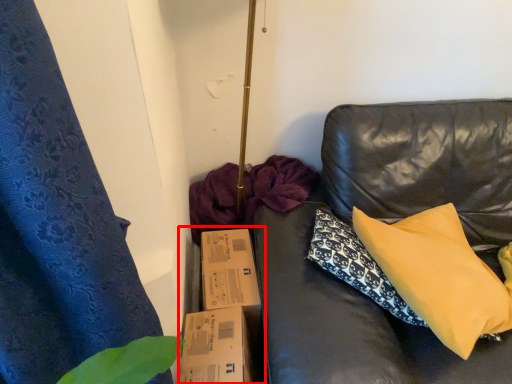
Question: Considering the relative positions of cardboard box (annotated by the red box) and pillow in the image provided, where is cardboard box (annotated by the red box) located with respect to the staircase?

Choices:
 (A) left
 (B) right

Answer: (A)